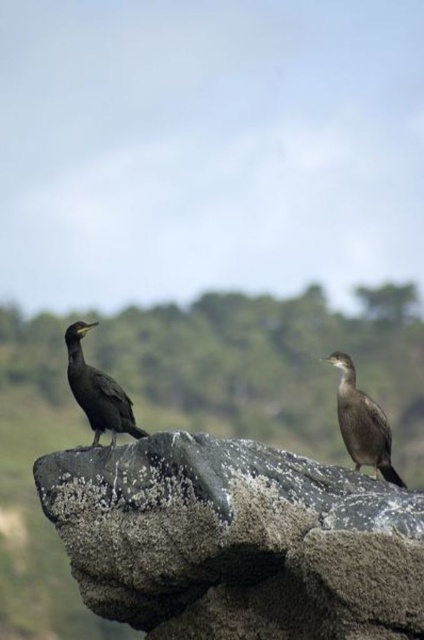
Consider the image. Can you confirm if dark brown feathers at right is positioned to the left of dark brown feathers at left?

In fact, dark brown feathers at right is to the right of dark brown feathers at left.

Does dark brown feathers at right have a greater width compared to dark brown feathers at left?

Incorrect, dark brown feathers at right's width does not surpass dark brown feathers at left's.

This screenshot has width=424, height=640. Describe the element at coordinates (362, 422) in the screenshot. I see `dark brown feathers at right` at that location.

At what (x,y) coordinates should I click in order to perform the action: click on dark brown feathers at right. Please return your answer as a coordinate pair (x, y). Looking at the image, I should click on pos(362,422).

Who is shorter, gray rough rock at center or dark brown feathers at left?

With less height is dark brown feathers at left.

Who is more distant from viewer, (x=259, y=461) or (x=105, y=390)?

Point (x=105, y=390)

Locate an element on the screen. The image size is (424, 640). gray rough rock at center is located at coordinates (236, 540).

What do you see at coordinates (236, 540) in the screenshot?
I see `gray rough rock at center` at bounding box center [236, 540].

Between gray rough rock at center and dark brown feathers at right, which one is positioned higher?

dark brown feathers at right

Is point (217, 636) in front of point (382, 426)?

That is True.

Image resolution: width=424 pixels, height=640 pixels. What are the coordinates of `gray rough rock at center` in the screenshot? It's located at (236, 540).